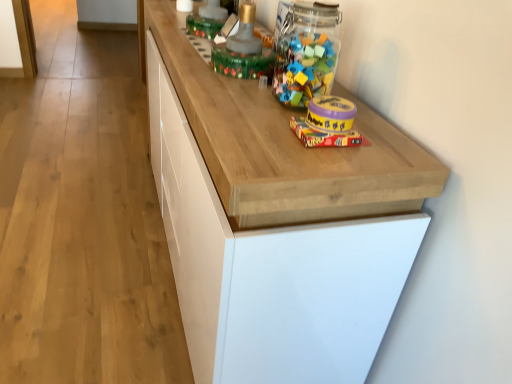
I want to click on vacant space in front of matte yellow plastic container at center, which ranks as the first toy in bottom-to-top order, so click(x=327, y=158).